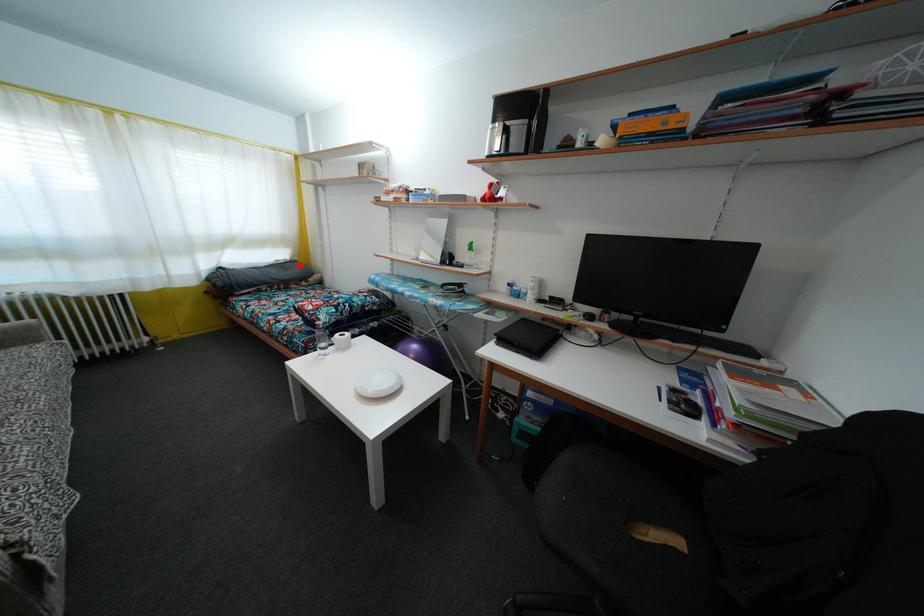
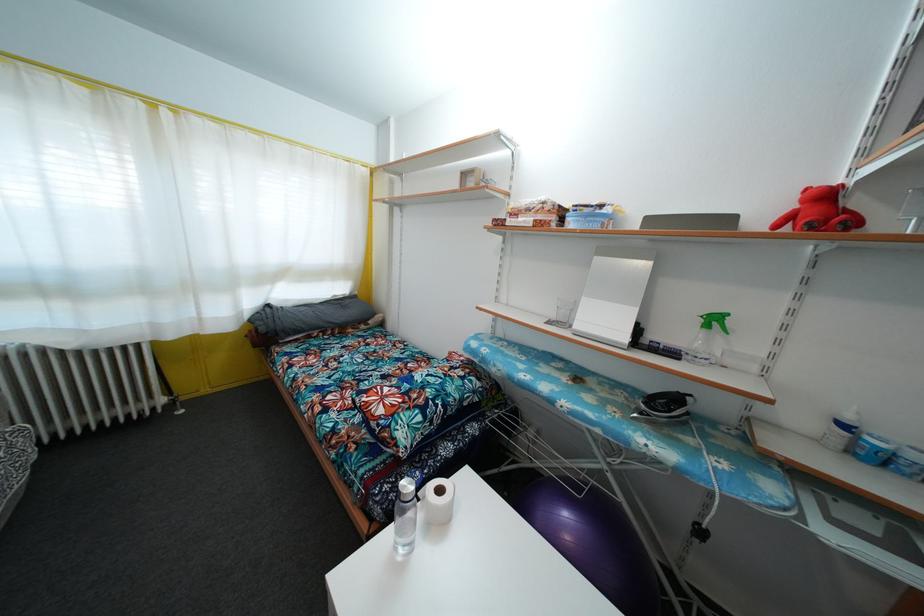
In the second image, find the point that corresponds to the highlighted location in the first image.

(359, 300)